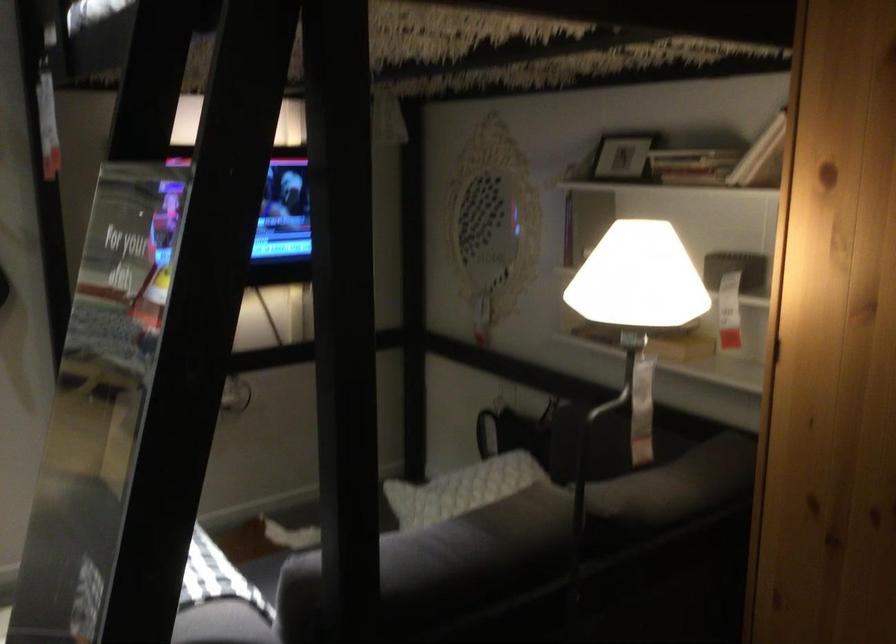
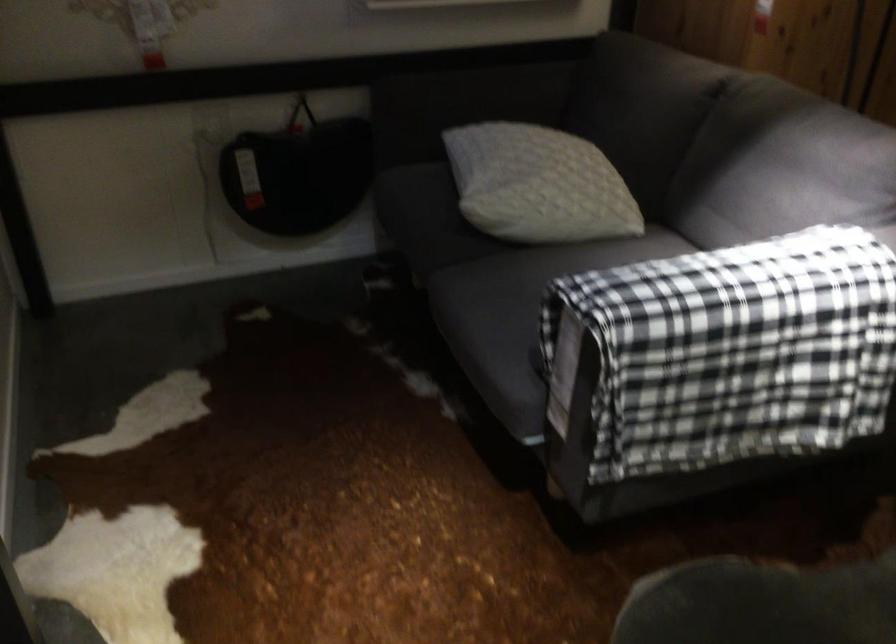
Locate, in the second image, the point that corresponds to point (426, 502) in the first image.

(538, 185)